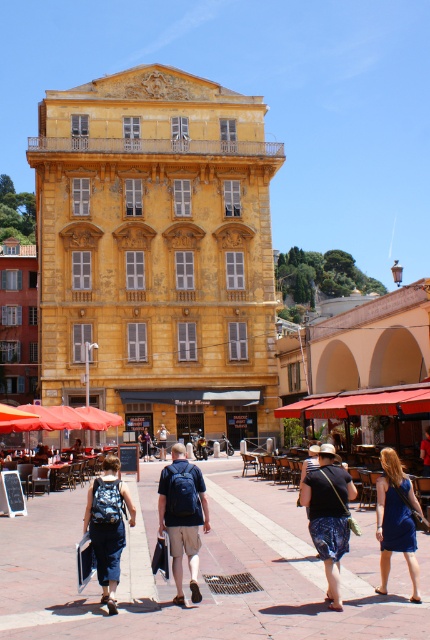
Can you confirm if blue fabric backpack at center is thinner than blue satin dress at lower right?

No, blue fabric backpack at center is not thinner than blue satin dress at lower right.

Who is more distant from viewer, (x=187, y=538) or (x=411, y=550)?

Positioned behind is point (x=187, y=538).

Locate an element on the screen. The height and width of the screenshot is (640, 430). blue fabric backpack at center is located at coordinates (183, 518).

You are a GUI agent. You are given a task and a screenshot of the screen. Output one action in this format:
    pyautogui.click(x=<x>, y=<y>)
    Task: Click on the blue fabric backpack at center
    The image size is (430, 640).
    Given the screenshot: What is the action you would take?
    pyautogui.click(x=183, y=518)

Which is below, denim pants at lower left or blue satin dress at lower right?

denim pants at lower left

Can you confirm if denim pants at lower left is wider than blue satin dress at lower right?

Indeed, denim pants at lower left has a greater width compared to blue satin dress at lower right.

The height and width of the screenshot is (640, 430). I want to click on denim pants at lower left, so click(x=107, y=525).

Is denim shorts at center shorter than denim pants at lower left?

In fact, denim shorts at center may be taller than denim pants at lower left.

Between point (323, 488) and point (111, 538), which one is positioned in front?

Point (111, 538)

Which is in front, point (325, 561) or point (116, 566)?

Point (325, 561) is more forward.

At what (x,y) coordinates should I click in order to perform the action: click on denim shorts at center. Please return your answer as a coordinate pair (x, y). The image size is (430, 640). Looking at the image, I should click on (328, 515).